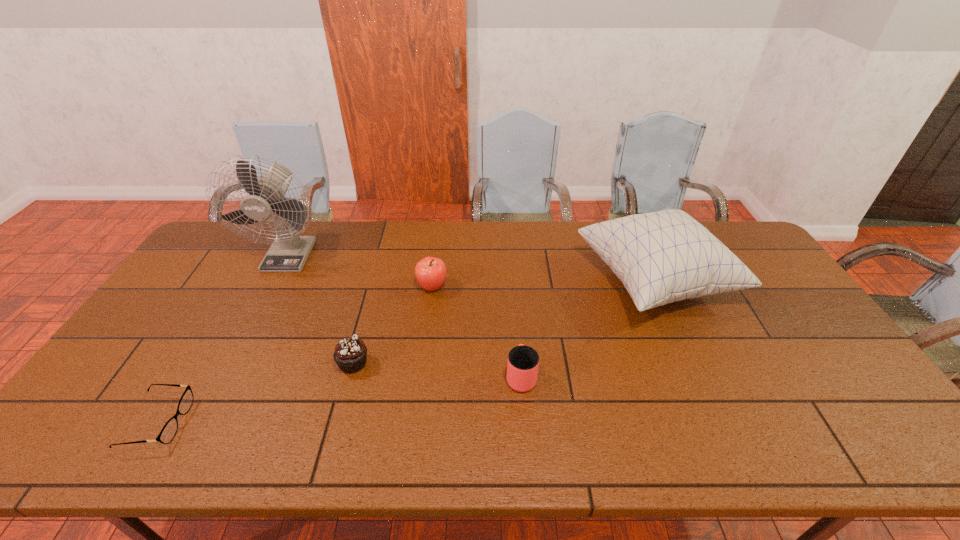
Locate an element on the screen. The width and height of the screenshot is (960, 540). vacant region located on the front of the fourth object from left to right is located at coordinates pyautogui.click(x=429, y=314).

The image size is (960, 540). Identify the location of vacant position located 0.330m on the handle side of the second object from right to left. (513, 278).

Where is `free spot located 0.250m on the handle side of the second object from right to left`? The image size is (960, 540). free spot located 0.250m on the handle side of the second object from right to left is located at coordinates (514, 295).

Find the location of a particular element. This screenshot has height=540, width=960. vacant space located 0.380m on the handle side of the second object from right to left is located at coordinates (512, 268).

Find the location of a particular element. vacant region located 0.100m on the back of the fourth object from right to left is located at coordinates (x=364, y=323).

Locate an element on the screen. vacant space located 0.280m on the front-facing side of the spectacles is located at coordinates (302, 422).

Where is `fan at the far edge`? The width and height of the screenshot is (960, 540). fan at the far edge is located at coordinates (289, 251).

You are a GUI agent. You are given a task and a screenshot of the screen. Output one action in this format:
    pyautogui.click(x=<x>, y=<y>)
    Task: Click on the cushion that is positioned at the far edge
    
    Given the screenshot: What is the action you would take?
    pyautogui.click(x=661, y=257)

At what (x,y) coordinates should I click in order to perform the action: click on object situated at the near edge. Please return your answer as a coordinate pair (x, y). The width and height of the screenshot is (960, 540). Looking at the image, I should click on (168, 432).

At what (x,y) coordinates should I click in order to perform the action: click on fan that is at the left edge. Please return your answer as a coordinate pair (x, y). The width and height of the screenshot is (960, 540). Looking at the image, I should click on (289, 251).